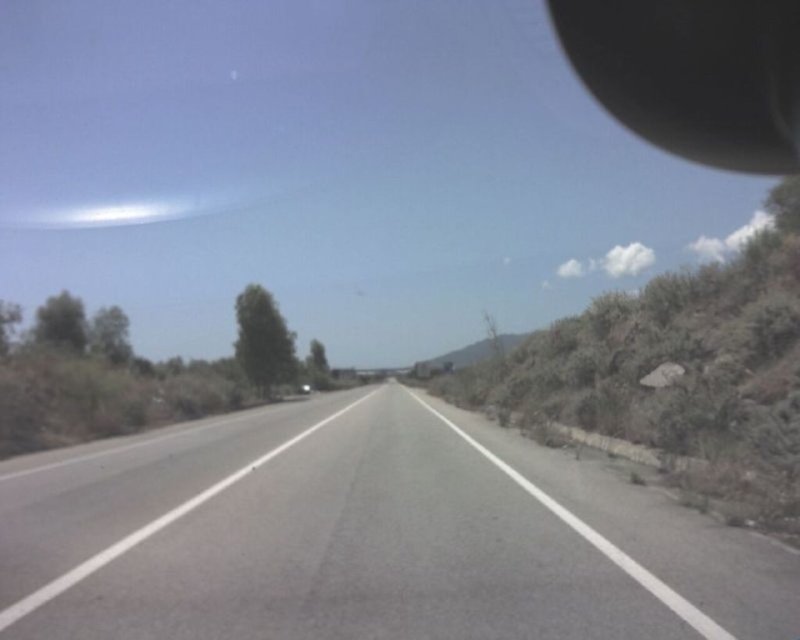
Question: Does asphalt road at center appear on the left side of black rubber rearview mirror at upper right?

Choices:
 (A) no
 (B) yes

Answer: (B)

Question: Is asphalt road at center positioned in front of black rubber rearview mirror at upper right?

Choices:
 (A) yes
 (B) no

Answer: (A)

Question: Can you confirm if asphalt road at center is wider than black rubber rearview mirror at upper right?

Choices:
 (A) no
 (B) yes

Answer: (A)

Question: Which object appears closest to the camera in this image?

Choices:
 (A) black rubber rearview mirror at upper right
 (B) asphalt road at center

Answer: (B)